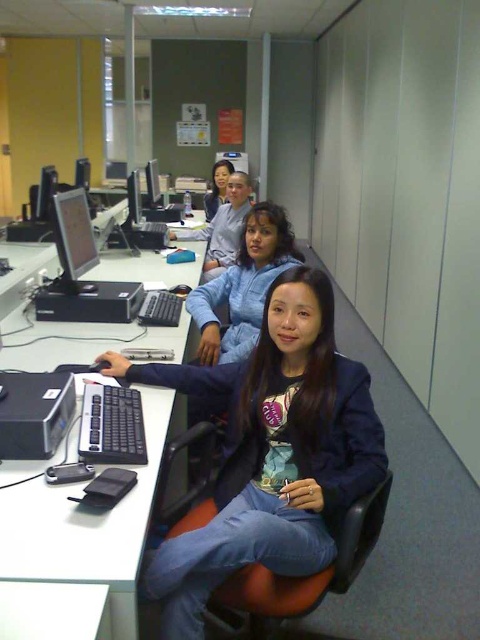
Is blue denim jeans at lower center to the left of matte blue hoodie at center from the viewer's perspective?

No, blue denim jeans at lower center is not to the left of matte blue hoodie at center.

Identify the location of blue denim jeans at lower center. The image size is (480, 640). (271, 451).

Between point (237, 291) and point (162, 195), which one is positioned behind?

The point (162, 195) is more distant.

Does blue fleece jacket at center appear under matte black monitor at upper center?

Correct, blue fleece jacket at center is located below matte black monitor at upper center.

Is point (261, 314) positioned in front of point (151, 163)?

Yes, it is.

The image size is (480, 640). What are the coordinates of `blue fleece jacket at center` in the screenshot? It's located at tap(242, 285).

Locate an element on the screen. blue fleece jacket at center is located at coordinates click(x=242, y=285).